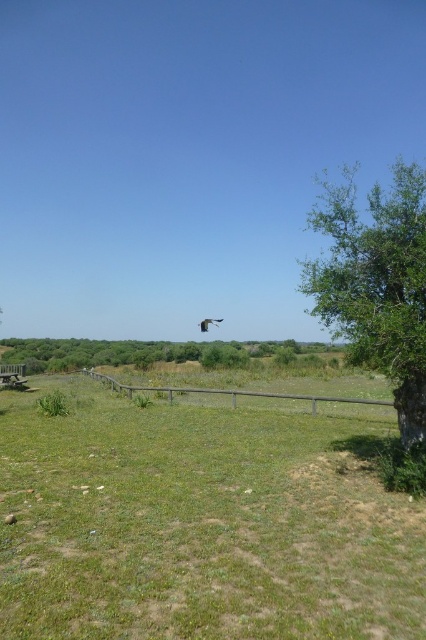
You are a bird flying over the scene and want to land on the highest tree. Which tree should you choose between the green leafy tree at right and the green leafy tree at center?

The green leafy tree at right is above the green leafy tree at center, so you should choose the green leafy tree at right to land on as it is higher.

You are standing in the middle of the grassy area looking towards the wooden fence. You see the green grass at lower left and the green leafy tree at right. Which object is closer to your current position?

The green grass at lower left is closer to your current position because it is located below the green leafy tree at right, indicating it is positioned nearer to the viewer in the scene.